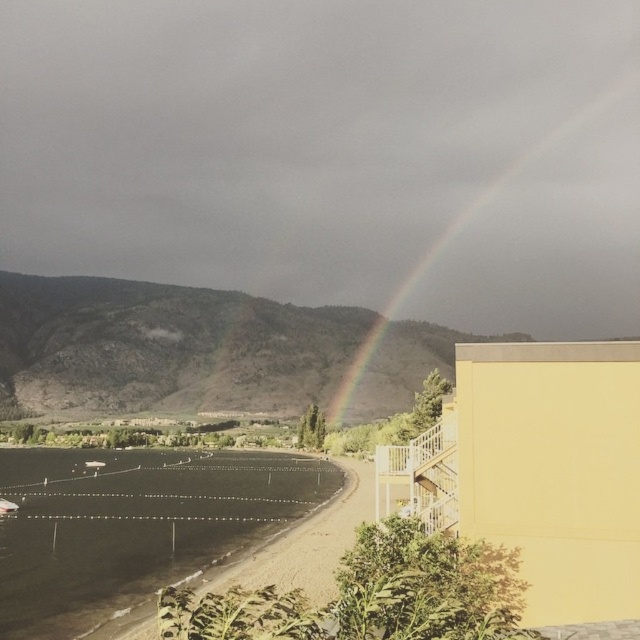
You are standing at the center of the image and want to walk to the black asphalt runway at lower left. In which direction should you head?

To reach the black asphalt runway at lower left from the center of the image, you should head towards the lower left direction.

You are a pilot preparing to land a small airplane on the black asphalt runway at lower left. You notice the rainbow at upper right in the distance. Which object is closer to the horizon?

The rainbow at upper right is closer to the horizon than the black asphalt runway at lower left because the runway is shorter, meaning it is positioned closer to the observer and farther from the horizon compared to the rainbow.